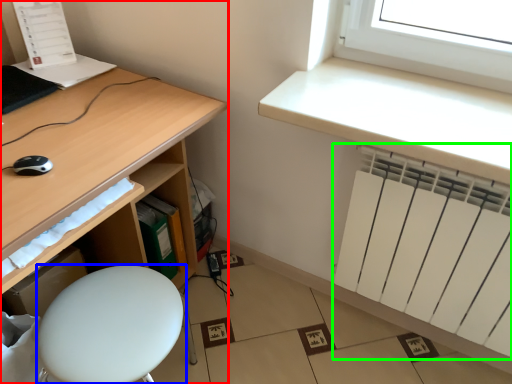
Question: Estimate the real-world distances between objects in this image. Which object is farther from desk (highlighted by a red box), furniture (highlighted by a blue box) or radiator (highlighted by a green box)?

Choices:
 (A) furniture
 (B) radiator

Answer: (B)